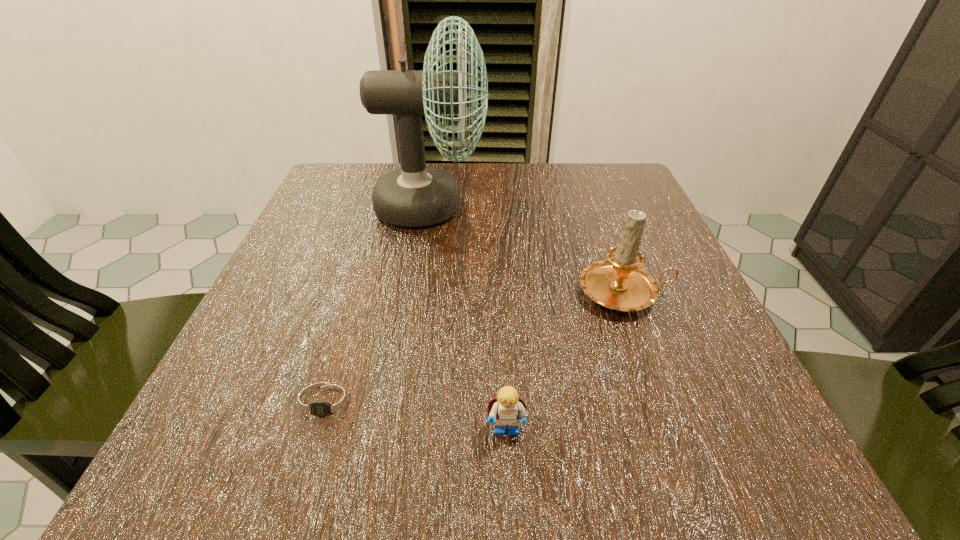
The width and height of the screenshot is (960, 540). Find the location of `Lego present at the near edge`. Lego present at the near edge is located at coordinates (505, 409).

In order to click on watch that is at the near edge in this screenshot , I will do `click(326, 404)`.

Find the location of `fan that is positioned at the left edge`. fan that is positioned at the left edge is located at coordinates (415, 195).

This screenshot has height=540, width=960. In order to click on watch at the left edge in this screenshot , I will do pyautogui.click(x=326, y=404).

What are the coordinates of `object at the right edge` in the screenshot? It's located at (619, 283).

Locate an element on the screen. object present at the far left corner is located at coordinates [x=415, y=195].

Identify the location of object located at the near left corner. (326, 404).

In the image, there is a desktop. At what (x,y) coordinates should I click in order to perform the action: click on vacant area at the far edge. Please return your answer as a coordinate pair (x, y). This screenshot has height=540, width=960. Looking at the image, I should click on (568, 190).

I want to click on free space at the near edge of the desktop, so click(x=459, y=453).

Identify the location of vacant space at the left edge of the desktop. (350, 218).